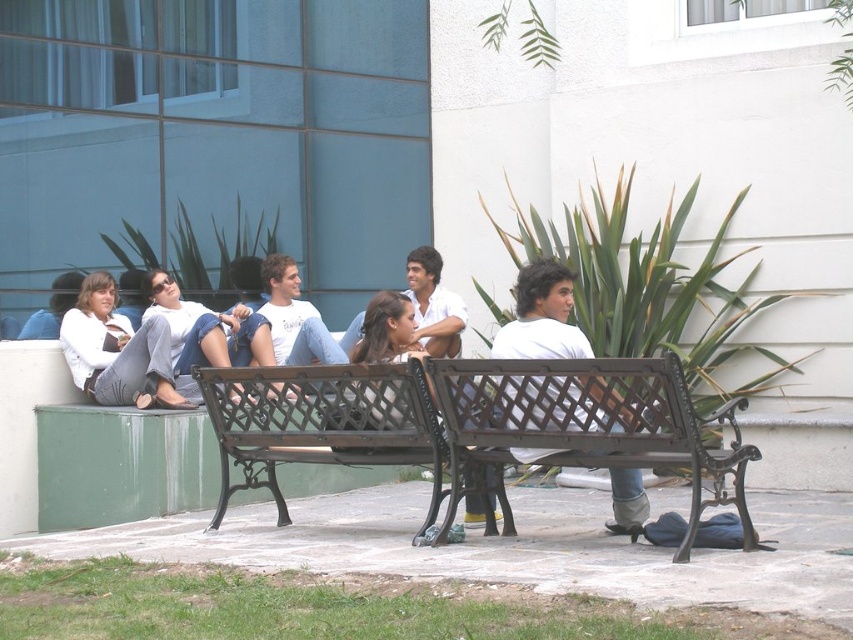
You are a photographer trying to capture a group photo of the matte white shirt at left and the white matte shirt at center. If you want both shirts to appear the same size in the photo, where should you position yourself relative to them?

Since the matte white shirt at left is wider than the white matte shirt at center, you should move closer to the white matte shirt at center and farther from the matte white shirt at left to balance their sizes in the photo.

You are standing in the park and want to take a photo of the dark brown wood bench at center and the white matte shirt at center. Which object should you focus on first to ensure both are in the frame?

You should focus on the dark brown wood bench at center first because it is closer to the viewer than the white matte shirt at center, ensuring both are in the frame.

You are standing in the park and see the dark brown wood bench at center and the white matte shirt at center. Which object is located to the right of the other?

The dark brown wood bench at center is positioned on the right side of white matte shirt at center.